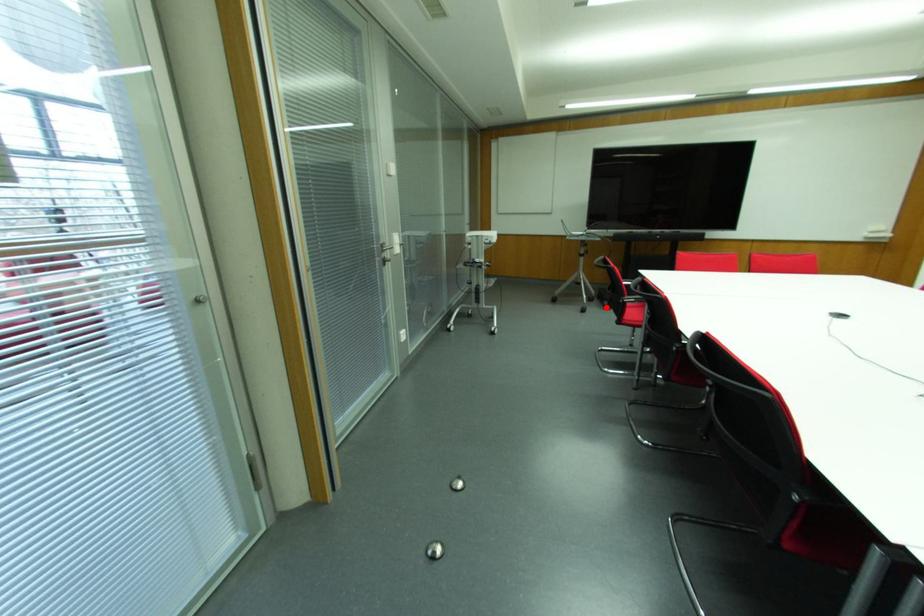
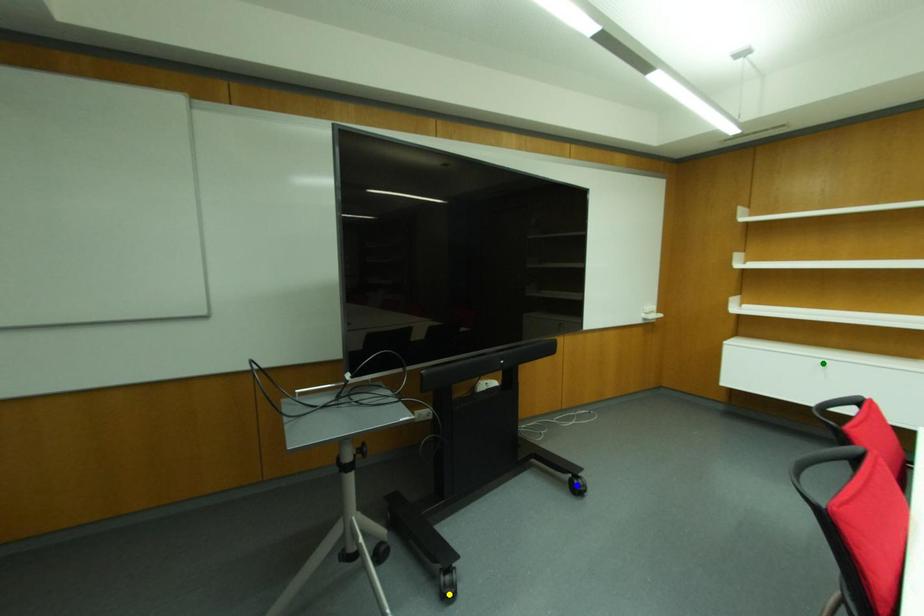
Question: I am providing you with two images of the same scene from different viewpoints. A red point is marked on the first image. You are given multiple points on the second image. Which mark in image 2 goes with the point in image 1?

Choices:
 (A) blue point
 (B) yellow point
 (C) green point

Answer: (B)